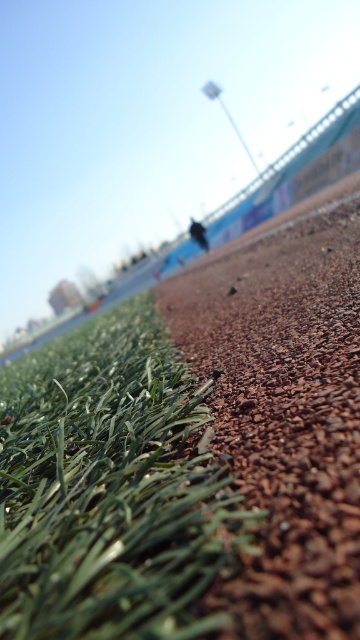
Question: Is green artificial turf at lower left closer to the viewer compared to brown gravel at center?

Choices:
 (A) no
 (B) yes

Answer: (A)

Question: Does green artificial turf at lower left have a greater width compared to brown gravel at center?

Choices:
 (A) no
 (B) yes

Answer: (A)

Question: Is green artificial turf at lower left behind brown gravel at center?

Choices:
 (A) no
 (B) yes

Answer: (B)

Question: Among these points, which one is nearest to the camera?

Choices:
 (A) (285, 531)
 (B) (142, 531)

Answer: (A)

Question: Which of the following is the farthest from the observer?

Choices:
 (A) brown gravel at center
 (B) green artificial turf at lower left

Answer: (B)